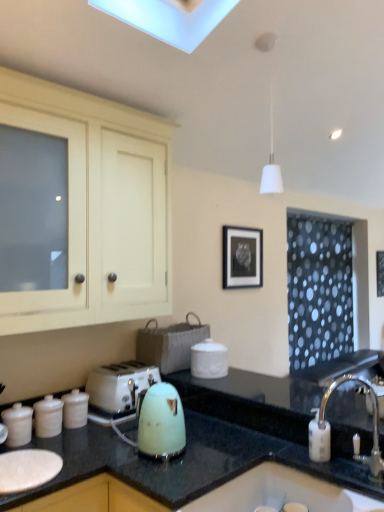
Question: Is white glossy canisters at lower left, placed as the 2th kitchen appliance when sorted from right to left, taller or shorter than matte cream cabinet at upper left?

Choices:
 (A) short
 (B) tall

Answer: (A)

Question: From a real-world perspective, is white glossy canisters at lower left, which is the 2th kitchen appliance in left-to-right order, physically located above or below matte cream cabinet at upper left?

Choices:
 (A) below
 (B) above

Answer: (A)

Question: Considering the real-world distances, which object is farthest from the matte cream cabinet at upper left?

Choices:
 (A) green glossy kettle at center
 (B) matte white canister at left, which is the third kitchen appliance in right-to-left order
 (C) silver metallic faucet at sink right
 (D) white glossy sink at lower right
 (E) white glossy canisters at lower left, which is the 2th kitchen appliance in left-to-right order

Answer: (C)

Question: Which object is the farthest from the silver metallic faucet at sink right?

Choices:
 (A) white glossy canisters at lower left, placed as the 2th kitchen appliance when sorted from right to left
 (B) mint green plastic kettle at center, the 1th kitchen appliance positioned from the right
 (C) white plastic toaster at lower left
 (D) matte cream cabinet at upper left
 (E) matte white canister at left, which is the 1th kitchen appliance from left to right

Answer: (E)